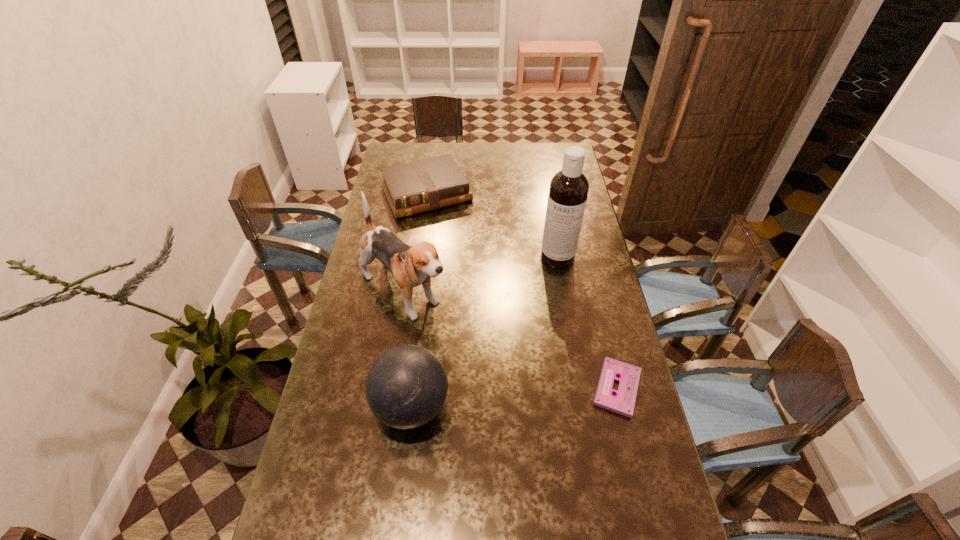
The width and height of the screenshot is (960, 540). Find the location of `free space on the desktop that is between the third tallest object and the videotape and is positioned at the face of the puppy`. free space on the desktop that is between the third tallest object and the videotape and is positioned at the face of the puppy is located at coordinates (523, 396).

Locate an element on the screen. This screenshot has height=540, width=960. free spot on the desktop that is between the bowling ball and the shortest object and is positioned on the label side of the tallest object is located at coordinates (525, 396).

Locate an element on the screen. free spot on the desktop that is between the third tallest object and the shortest object and is positioned on the spine side of the fourth tallest object is located at coordinates (539, 395).